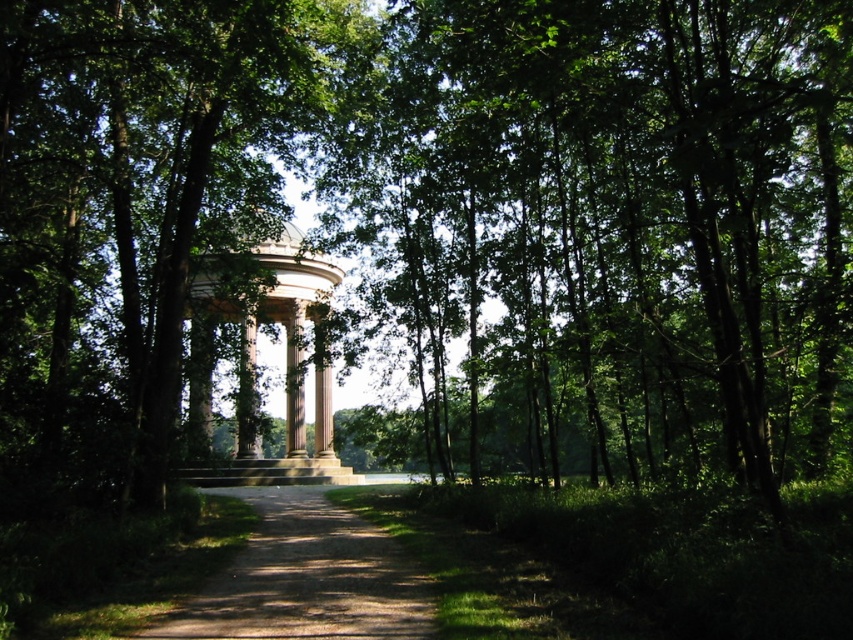
Question: Is dirt/gravel path at center positioned before white marble gazebo at center?

Choices:
 (A) no
 (B) yes

Answer: (B)

Question: In this image, where is dirt/gravel path at center located relative to white marble gazebo at center?

Choices:
 (A) below
 (B) above

Answer: (A)

Question: Which object appears farthest from the camera in this image?

Choices:
 (A) dirt/gravel path at center
 (B) white marble gazebo at center

Answer: (B)

Question: Is dirt/gravel path at center thinner than white marble gazebo at center?

Choices:
 (A) no
 (B) yes

Answer: (B)

Question: Which point is farther to the camera?

Choices:
 (A) (315, 404)
 (B) (387, 605)

Answer: (A)